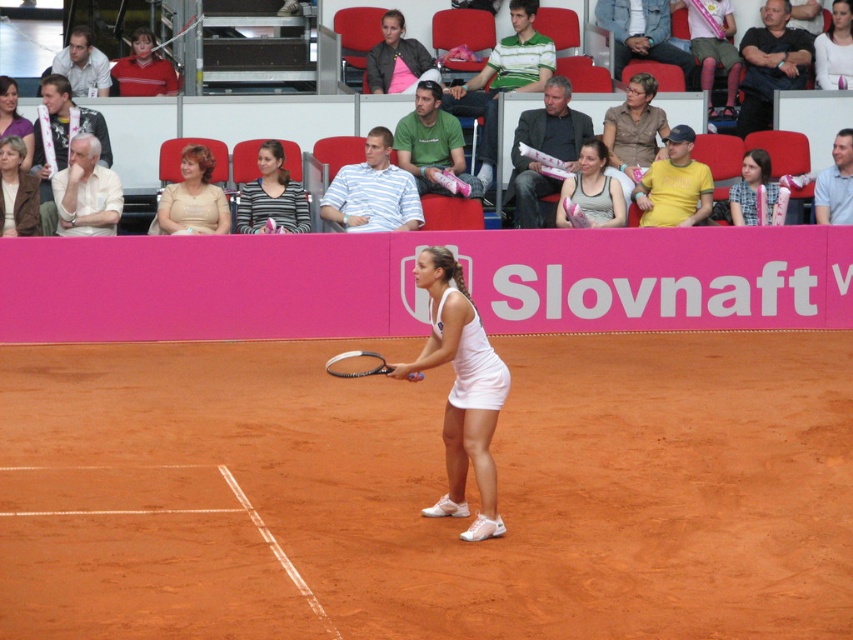
Can you confirm if clay tennis court at center is shorter than smooth white tank top at center?

No, clay tennis court at center is not shorter than smooth white tank top at center.

Is point (148, 392) closer to camera compared to point (843, 26)?

That is True.

The image size is (853, 640). Identify the location of clay tennis court at center. (428, 492).

Does clay tennis court at center have a smaller size compared to brown leather jacket at upper left?

No.

Is point (51, 636) less distant than point (36, 182)?

Yes, point (51, 636) is in front of point (36, 182).

Locate an element on the screen. clay tennis court at center is located at coordinates pyautogui.click(x=428, y=492).

Is matte beige blouse at center closer to the viewer compared to black rubber tennis racket at center?

No, matte beige blouse at center is behind black rubber tennis racket at center.

Can you confirm if matte beige blouse at center is bigger than black rubber tennis racket at center?

Correct, matte beige blouse at center is larger in size than black rubber tennis racket at center.

This screenshot has width=853, height=640. I want to click on matte beige blouse at center, so click(x=192, y=198).